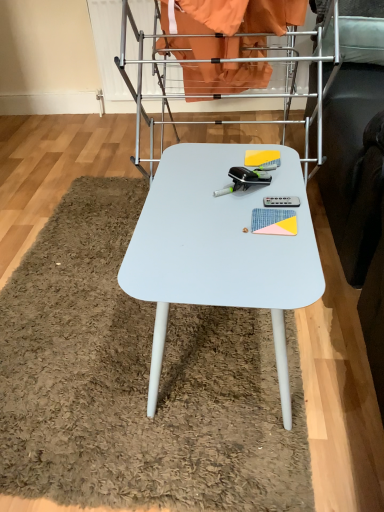
Question: In terms of height, does metallic silver drying rack at center look taller or shorter compared to white matte table at center?

Choices:
 (A) tall
 (B) short

Answer: (A)

Question: From the image's perspective, is metallic silver drying rack at center positioned above or below white matte table at center?

Choices:
 (A) below
 (B) above

Answer: (B)

Question: From a real-world perspective, relative to white matte table at center, is metallic silver drying rack at center vertically above or below?

Choices:
 (A) below
 (B) above

Answer: (B)

Question: Is point (218, 229) closer or farther from the camera than point (317, 28)?

Choices:
 (A) closer
 (B) farther

Answer: (A)

Question: Relative to metallic silver drying rack at center, is white matte table at center in front or behind?

Choices:
 (A) behind
 (B) front

Answer: (B)

Question: Looking at the image, does white matte table at center seem bigger or smaller compared to metallic silver drying rack at center?

Choices:
 (A) big
 (B) small

Answer: (B)

Question: Considering the positions of white matte table at center and metallic silver drying rack at center in the image, is white matte table at center taller or shorter than metallic silver drying rack at center?

Choices:
 (A) tall
 (B) short

Answer: (B)